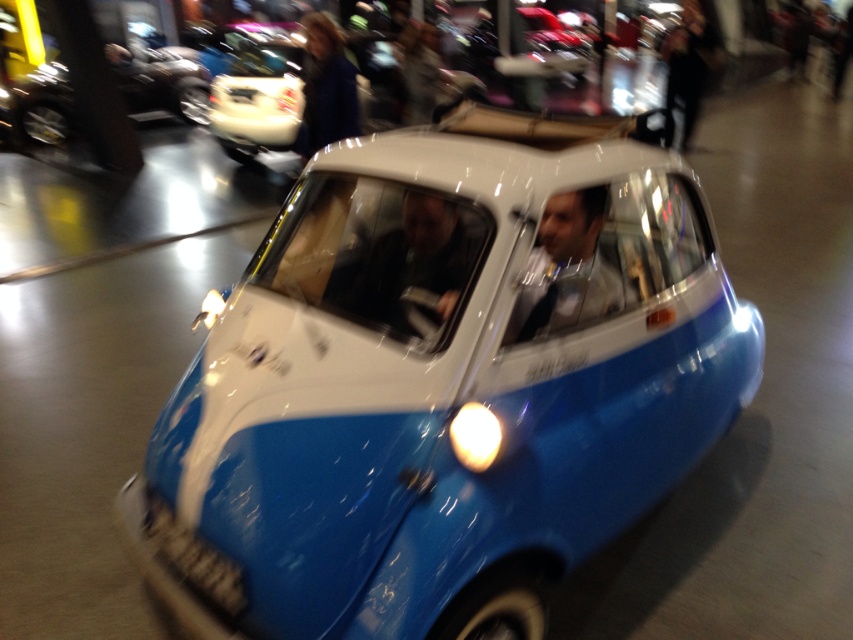
Question: Is matte black suit at center smaller than blue matte car at upper left?

Choices:
 (A) no
 (B) yes

Answer: (B)

Question: Can you confirm if blue matte car at upper left is bigger than blue fabric coat at upper center?

Choices:
 (A) no
 (B) yes

Answer: (B)

Question: Which is nearer to the blue matte toy car at center?

Choices:
 (A) blue fabric coat at upper center
 (B) matte blue car at center
 (C) blue matte car at upper left

Answer: (B)

Question: Estimate the real-world distances between objects in this image. Which object is closer to the matte blue car at center?

Choices:
 (A) blue fabric coat at upper center
 (B) blue matte toy car at center
 (C) blue matte car at upper left
 (D) matte black suit at center

Answer: (B)

Question: Which point is closer to the camera?

Choices:
 (A) blue matte car at upper left
 (B) matte black suit at center
 (C) matte blue car at center
 (D) blue matte toy car at center

Answer: (D)

Question: Can you confirm if blue matte car at upper left is positioned below blue fabric coat at upper center?

Choices:
 (A) no
 (B) yes

Answer: (A)